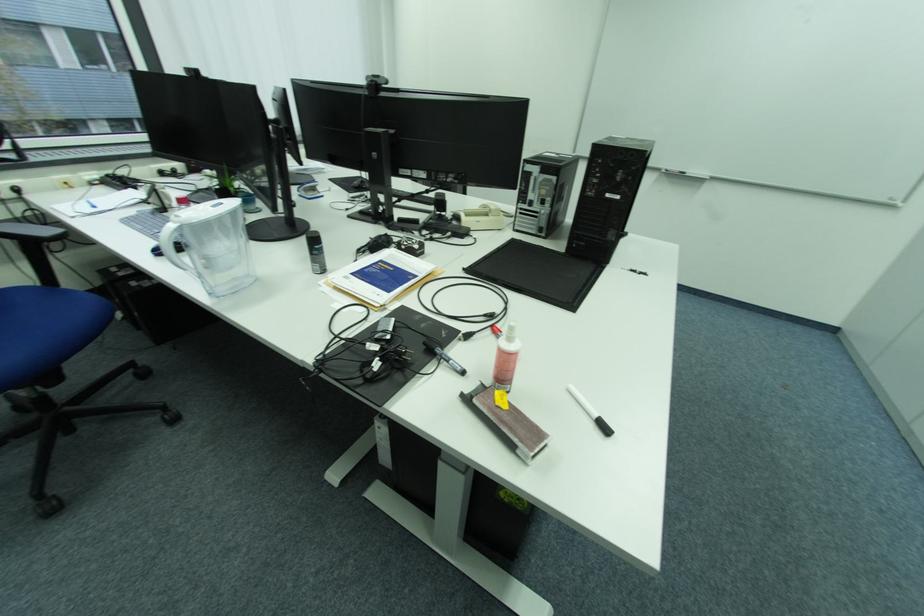
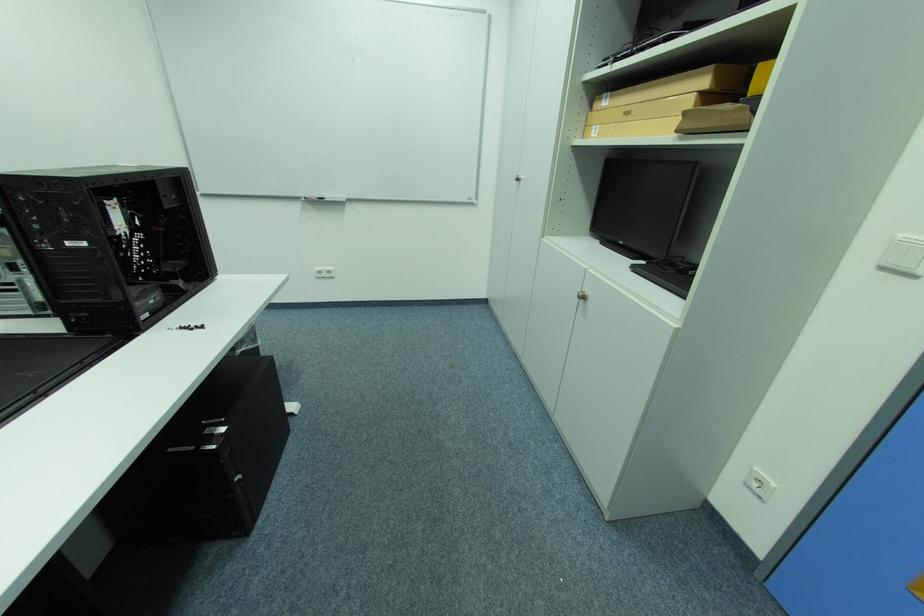
Locate, in the second image, the point that corresponds to point (694, 174) in the first image.

(331, 199)